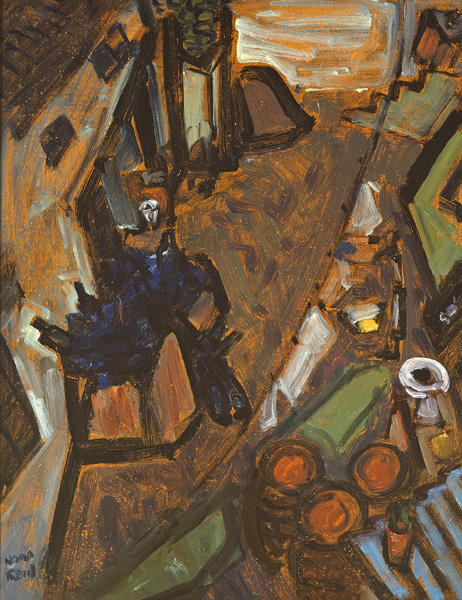
The image size is (462, 600). I want to click on painting, so click(228, 413).